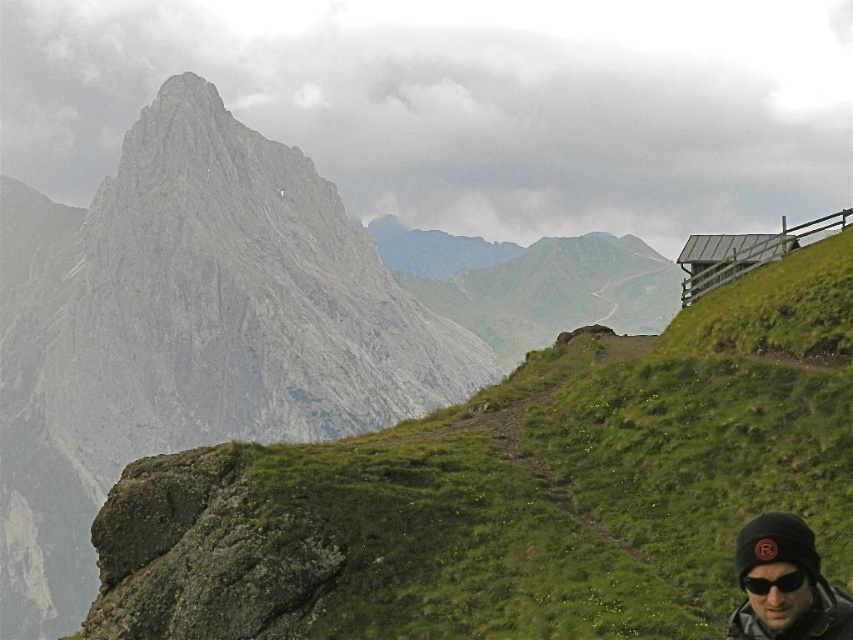
You are standing on the grassy hillside and want to place your black matte sunglasses at lower right on the ground. Which direction should you move to place them so they are positioned to the left of the green grassy at upper center?

You should move to your left because the green grassy at upper center is currently to the right of the black matte sunglasses at lower right, so moving left would position the sunglasses to the left of the grassy area.

You are a hiker standing on the grassy hillside and want to place your black matte sunglasses at lower right on the ground so they won not roll away. Given the terrain described in the scene, where should you place them relative to the green grassy at upper center?

You should place the black matte sunglasses at lower right below the green grassy at upper center since the green grassy at upper center is located above the black matte sunglasses at lower right, indicating a downward slope from the grassy area to the sunglasses location.